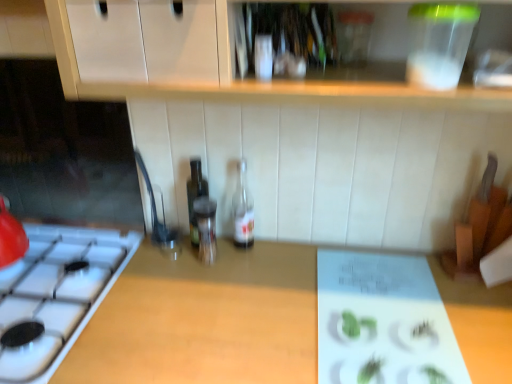
Question: Is transparent glass bottle at center, the 2th bottle positioned from the right, oriented towards clear glass bottle at center, the first bottle positioned from the right?

Choices:
 (A) no
 (B) yes

Answer: (A)

Question: Are transparent glass bottle at center, the 2th bottle positioned from the right, and clear glass bottle at center, acting as the 3th bottle starting from the left, far apart?

Choices:
 (A) no
 (B) yes

Answer: (A)

Question: Is transparent glass bottle at center, the 2th bottle positioned from the right, wider than clear glass bottle at center, the first bottle positioned from the right?

Choices:
 (A) yes
 (B) no

Answer: (B)

Question: Is the position of transparent glass bottle at center, the 2th bottle positioned from the right, more distant than that of clear glass bottle at center, the first bottle positioned from the right?

Choices:
 (A) no
 (B) yes

Answer: (A)

Question: From a real-world perspective, is transparent glass bottle at center, the 2th bottle positioned from the right, physically above clear glass bottle at center, the first bottle positioned from the right?

Choices:
 (A) no
 (B) yes

Answer: (A)

Question: Is clear glass bottle at center, acting as the 3th bottle starting from the left, at the back of transparent glass bottle at center, the 2th bottle positioned from the right?

Choices:
 (A) no
 (B) yes

Answer: (A)

Question: Is translucent glass bottle at center, arranged as the 1th bottle when viewed from the left, smaller than transparent glass bottle at center, which is the 2th bottle from left to right?

Choices:
 (A) yes
 (B) no

Answer: (B)

Question: Does translucent glass bottle at center, the third bottle in the right-to-left sequence, have a greater height compared to transparent glass bottle at center, which is the 2th bottle from left to right?

Choices:
 (A) yes
 (B) no

Answer: (A)

Question: From the image's perspective, is translucent glass bottle at center, the third bottle in the right-to-left sequence, on transparent glass bottle at center, which is the 2th bottle from left to right?

Choices:
 (A) yes
 (B) no

Answer: (A)

Question: From a real-world perspective, is translucent glass bottle at center, arranged as the 1th bottle when viewed from the left, below transparent glass bottle at center, the 2th bottle positioned from the right?

Choices:
 (A) no
 (B) yes

Answer: (A)

Question: Can you confirm if translucent glass bottle at center, the third bottle in the right-to-left sequence, is positioned to the right of transparent glass bottle at center, the 2th bottle positioned from the right?

Choices:
 (A) no
 (B) yes

Answer: (A)

Question: Can we say translucent glass bottle at center, the third bottle in the right-to-left sequence, lies outside transparent glass bottle at center, which is the 2th bottle from left to right?

Choices:
 (A) yes
 (B) no

Answer: (A)

Question: From the image's perspective, is clear glass bottle at center, acting as the 3th bottle starting from the left, on top of wooden at center?

Choices:
 (A) no
 (B) yes

Answer: (B)